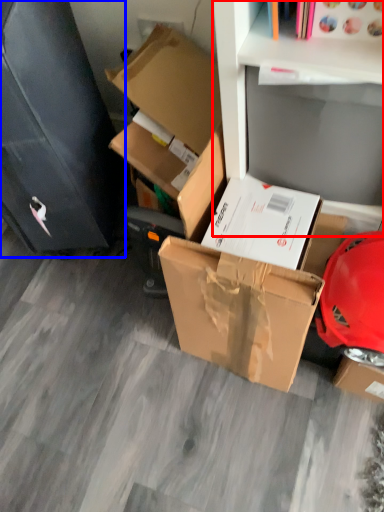
Question: Among these objects, which one is nearest to the camera, shelf (highlighted by a red box) or file cabinet (highlighted by a blue box)?

Choices:
 (A) shelf
 (B) file cabinet

Answer: (A)